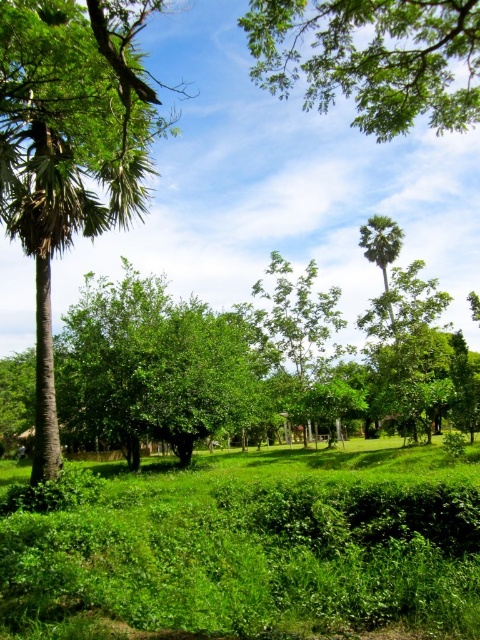
You are standing in the park and see both the green leafy tree at upper center and the green leafy palm at upper center. Which one is positioned to the left?

The green leafy tree at upper center is positioned to the left of the green leafy palm at upper center.

You are standing in the park and want to walk from the point closer to you to the point further away. Which path would you take between the two points, point [20,476] and point [371,230]?

The point closer to the viewer is point [20,476], so you would walk from there to point [371,230], which is further away.